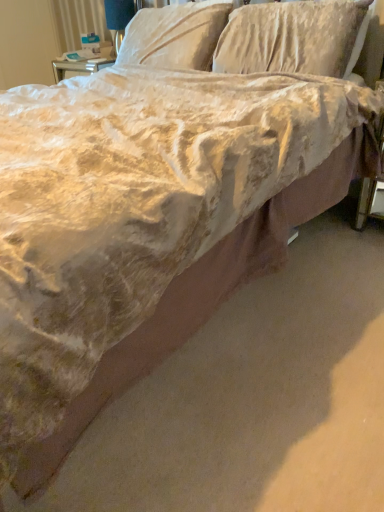
Question: Should I look upward or downward to see velvet-like beige pillow at upper center, acting as the second pillow starting from the right?

Choices:
 (A) up
 (B) down

Answer: (A)

Question: From the image's perspective, does matte white table lamp at upper center appear lower than velvet-like beige pillow at upper center, the 1th pillow when ordered from right to left?

Choices:
 (A) no
 (B) yes

Answer: (A)

Question: Would you say matte white table lamp at upper center is outside velvet-like beige pillow at upper center, the second pillow positioned from the left?

Choices:
 (A) yes
 (B) no

Answer: (A)

Question: Is matte white table lamp at upper center oriented towards velvet-like beige pillow at upper center, the second pillow positioned from the left?

Choices:
 (A) no
 (B) yes

Answer: (A)

Question: Is matte white table lamp at upper center not close to velvet-like beige pillow at upper center, the 1th pillow when ordered from right to left?

Choices:
 (A) yes
 (B) no

Answer: (A)

Question: Is the depth of matte white table lamp at upper center greater than that of velvet-like beige pillow at upper center, the 1th pillow when ordered from right to left?

Choices:
 (A) no
 (B) yes

Answer: (B)

Question: Is matte white table lamp at upper center looking in the opposite direction of velvet-like beige pillow at upper center, the second pillow positioned from the left?

Choices:
 (A) yes
 (B) no

Answer: (B)

Question: Can you confirm if matte white table lamp at upper center is positioned to the right of velvet-like beige pillow at upper center, acting as the second pillow starting from the right?

Choices:
 (A) no
 (B) yes

Answer: (A)

Question: Does matte white table lamp at upper center have a greater height compared to velvet-like beige pillow at upper center, which is counted as the 1th pillow, starting from the left?

Choices:
 (A) yes
 (B) no

Answer: (A)

Question: From a real-world perspective, is matte white table lamp at upper center below velvet-like beige pillow at upper center, acting as the second pillow starting from the right?

Choices:
 (A) no
 (B) yes

Answer: (B)

Question: Is velvet-like beige pillow at upper center, acting as the second pillow starting from the right, at the back of matte white table lamp at upper center?

Choices:
 (A) no
 (B) yes

Answer: (A)

Question: Can you confirm if matte white table lamp at upper center is bigger than velvet-like beige pillow at upper center, which is counted as the 1th pillow, starting from the left?

Choices:
 (A) no
 (B) yes

Answer: (A)

Question: Is the depth of matte white table lamp at upper center greater than that of velvet-like beige pillow at upper center, acting as the second pillow starting from the right?

Choices:
 (A) no
 (B) yes

Answer: (B)

Question: Is velvet-like beige pillow at upper center, which is counted as the 1th pillow, starting from the left, looking in the opposite direction of velvet-like beige pillow at upper center, the 1th pillow when ordered from right to left?

Choices:
 (A) no
 (B) yes

Answer: (A)